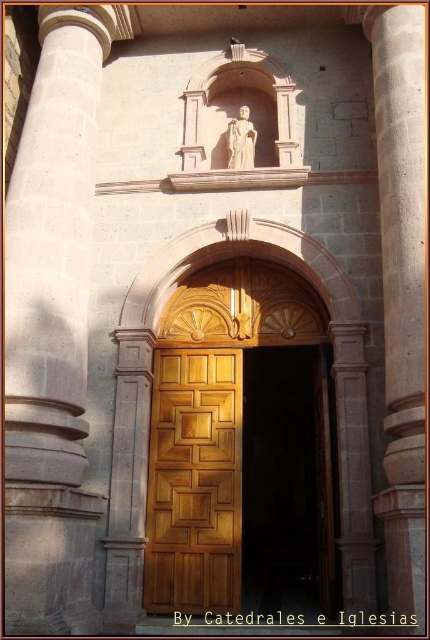
Which is below, gray stone column at center or matte stone statue at upper center?

gray stone column at center

Can you confirm if gray stone column at center is thinner than matte stone statue at upper center?

No, gray stone column at center is not thinner than matte stone statue at upper center.

Who is more distant from viewer, (43, 456) or (245, 157)?

The point (245, 157) is behind.

Locate an element on the screen. The image size is (430, 640). gray stone column at center is located at coordinates (52, 330).

Between point (245, 532) and point (245, 157), which one is positioned in front?

Point (245, 157) is in front.

Is wooden door at center positioned behind matte stone statue at upper center?

No, it is not.

The width and height of the screenshot is (430, 640). I want to click on wooden door at center, so click(239, 480).

Locate an element on the screen. This screenshot has height=640, width=430. wooden door at center is located at coordinates (239, 480).

Is polished wood door at center behind matte stone statue at upper center?

No, it is not.

Who is taller, polished wood door at center or matte stone statue at upper center?

polished wood door at center

Is point (154, 403) positioned behind point (245, 124)?

That is False.

At what (x,y) coordinates should I click in order to perform the action: click on polished wood door at center. Please return your answer as a coordinate pair (x, y). The width and height of the screenshot is (430, 640). Looking at the image, I should click on (194, 483).